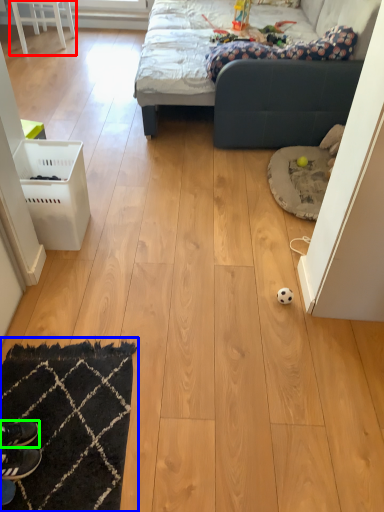
Question: Which object is the farthest from furniture (highlighted by a red box)? Choose among these: mat (highlighted by a blue box) or footwear (highlighted by a green box).

Choices:
 (A) mat
 (B) footwear

Answer: (B)